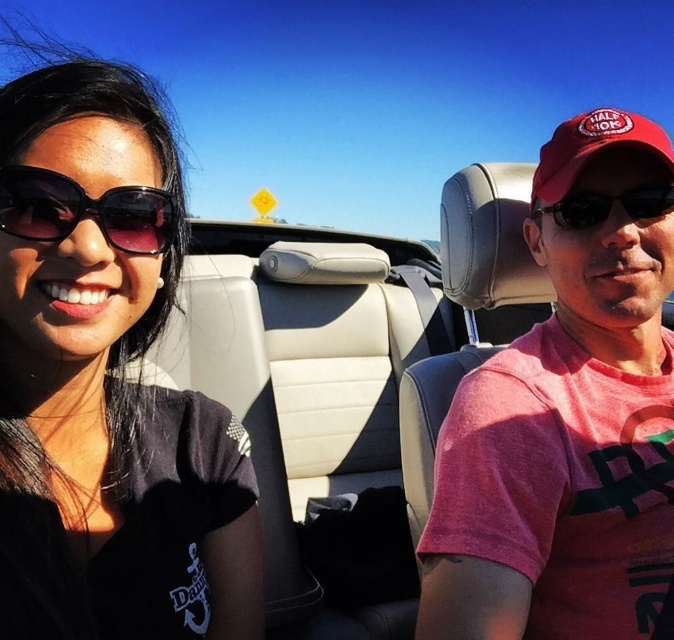
You are designing a layout for a magazine cover and need to place two elements based on their sizes. You have a pink cotton shirt at center and black plastic sunglasses at right. Which object should you place first if you want to prioritize the larger item?

The pink cotton shirt at center should be placed first since its width surpasses the black plastic sunglasses at right, making it the larger item.

You are a photographer trying to capture both the black matte sunglasses at upper left and the matte black sunglasses at left in a single shot. Which sunglasses are located higher up in the frame?

The black matte sunglasses at upper left are positioned higher up in the frame compared to the matte black sunglasses at left.